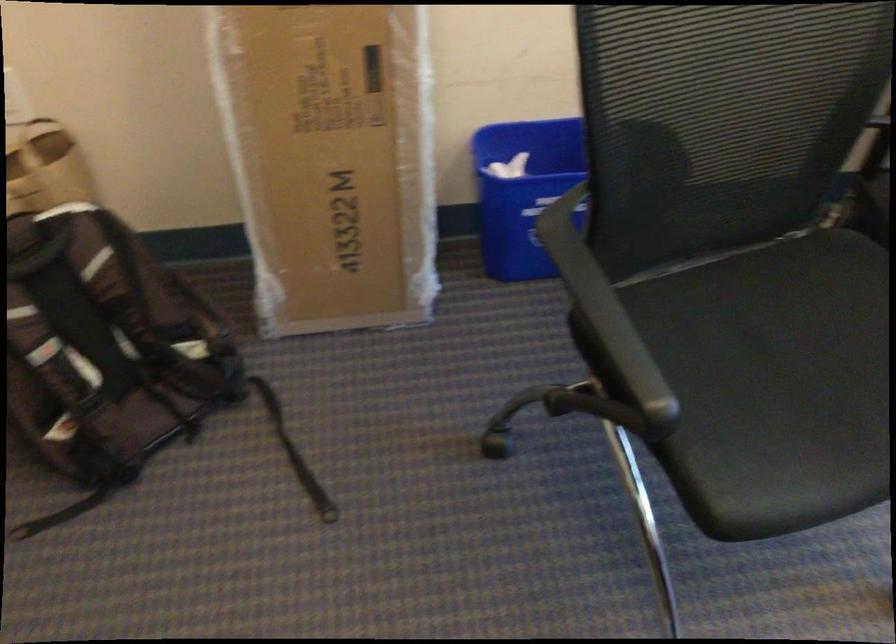
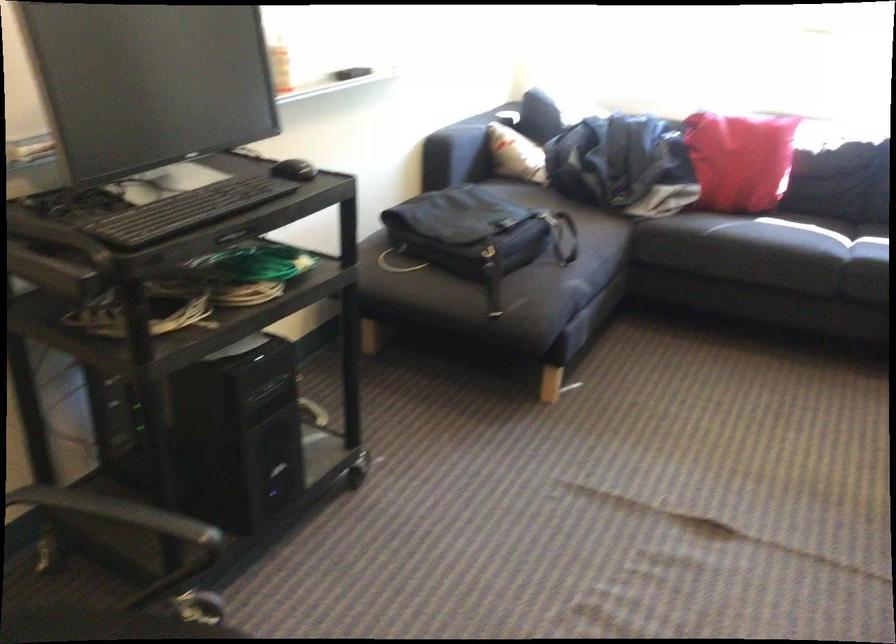
Question: How did the camera likely rotate?

Choices:
 (A) Left
 (B) Right
 (C) Up
 (D) Down

Answer: (B)